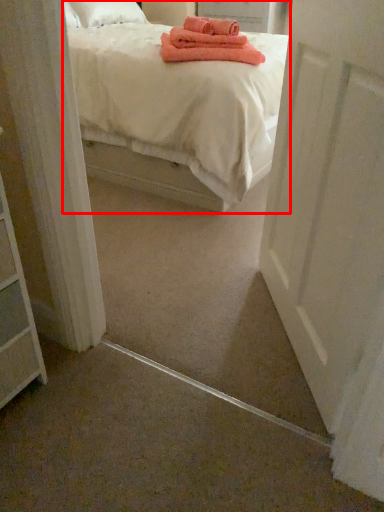
Question: From the image's perspective, where is bed (annotated by the red box) located in relation to door in the image?

Choices:
 (A) below
 (B) above

Answer: (B)